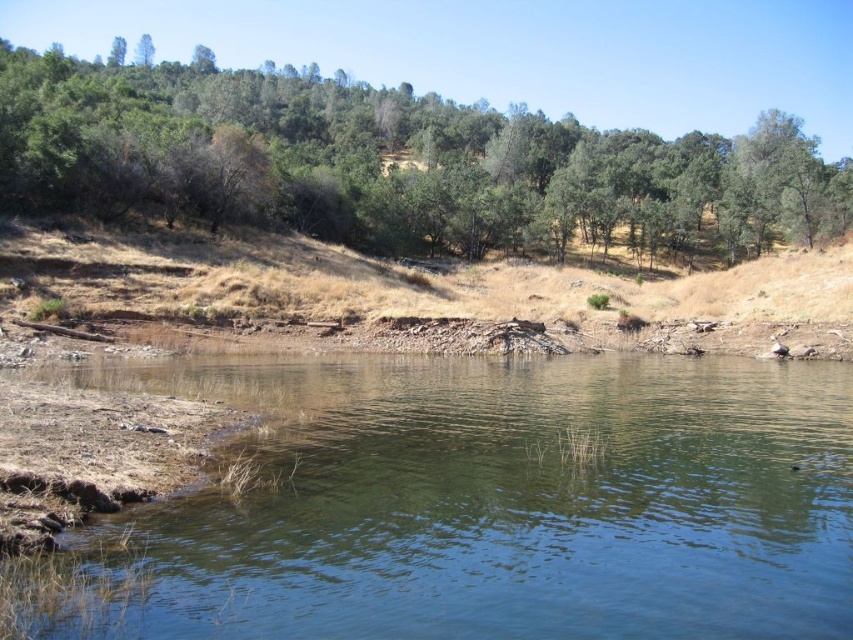
Who is more forward, (659, 563) or (22, 284)?

Point (659, 563)

Does clear water at center appear on the left side of brown dirt at center?

Yes, clear water at center is to the left of brown dirt at center.

The height and width of the screenshot is (640, 853). What do you see at coordinates (503, 500) in the screenshot? I see `clear water at center` at bounding box center [503, 500].

Locate an element on the screen. The image size is (853, 640). clear water at center is located at coordinates (503, 500).

Is clear water at center taller than green leafy tree at upper center?

No.

Does clear water at center have a greater width compared to green leafy tree at upper center?

No.

Is point (173, 378) farther from camera compared to point (836, 193)?

No, it is in front of (836, 193).

Where is `clear water at center`? clear water at center is located at coordinates [503, 500].

Is green leafy tree at upper center above brown dirt at center?

Yes, green leafy tree at upper center is above brown dirt at center.

Who is more forward, (273, 209) or (379, 324)?

Point (379, 324) is in front.

Is point (236, 195) in front of point (677, 288)?

Yes, it is.

Locate an element on the screen. The image size is (853, 640). green leafy tree at upper center is located at coordinates (393, 168).